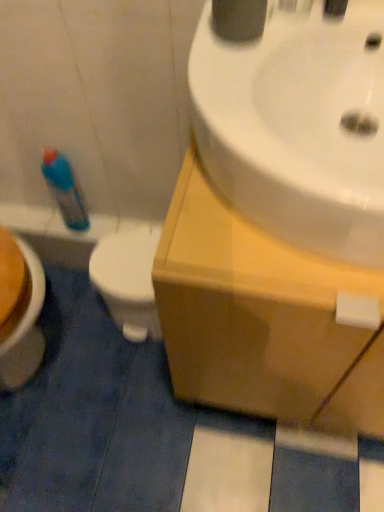
The image size is (384, 512). I want to click on empty space that is ontop of blue plastic bottle at left (from a real-world perspective), so click(54, 224).